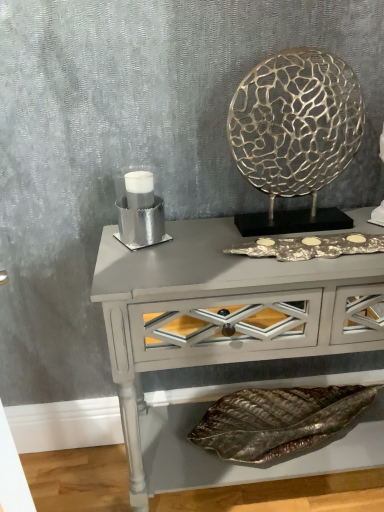
Locate an element on the screen. vacant region to the right of silver metallic candle holder at left is located at coordinates (199, 241).